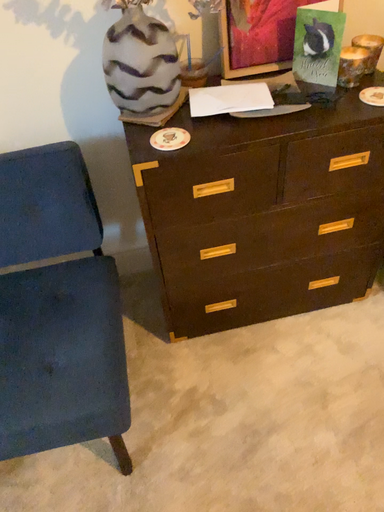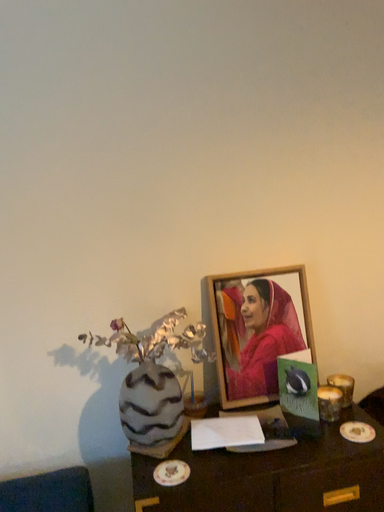
Question: Which way did the camera rotate in the video?

Choices:
 (A) rotated upward
 (B) rotated downward

Answer: (A)